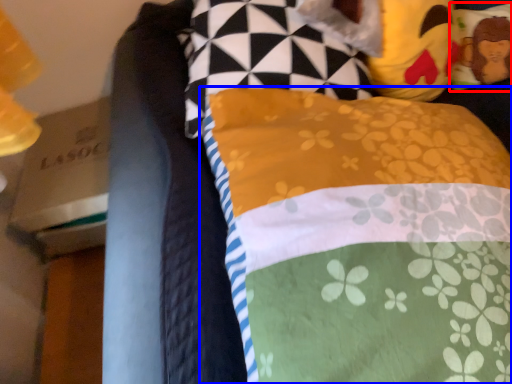
Question: Among these objects, which one is nearest to the camera, pillow (highlighted by a red box) or pillow (highlighted by a blue box)?

Choices:
 (A) pillow
 (B) pillow

Answer: (B)